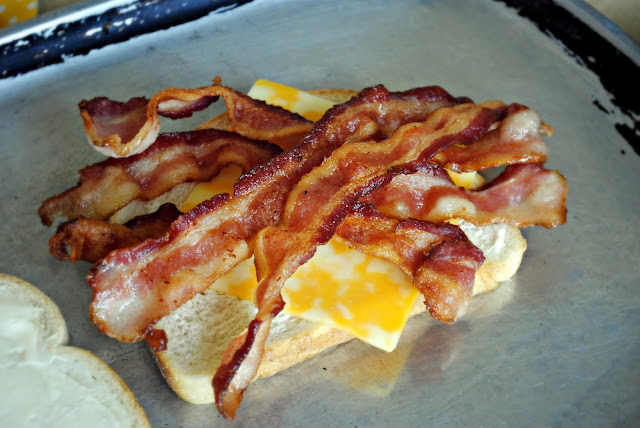
Image resolution: width=640 pixels, height=428 pixels. I want to click on baking sheet, so click(580, 305).